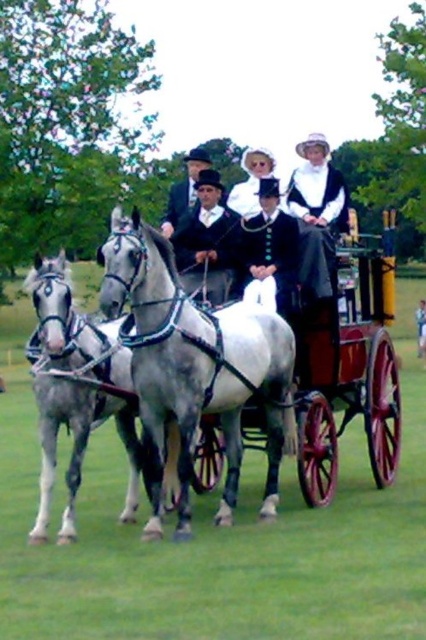
Looking at this image, you are standing in the field and want to approach the gray glossy horse at center. If your walking speed is 1.5 meters per second, how many seconds will it take you to reach the horse?

The gray glossy horse at center is 7.75 meters away from viewer. At a walking speed of 1.5 meters per second, it would take approximately 5.17 seconds to reach the horse.

You are a photographer at the historical reenactment event. You notice a woman wearing a white lace dress at center and a man wearing a smooth black coat at center. Which piece of clothing is positioned higher on their respective bodies?

The white lace dress at center is above the smooth black coat at center, so the white lace dress at center is positioned higher on her body compared to the smooth black coat at center.

You are standing in the grassy field and want to locate the gray glossy horse at center. According to the coordinates provided, where should you look relative to your position?

You should look towards the coordinates point at (x=195, y=368) to locate the gray glossy horse at center.